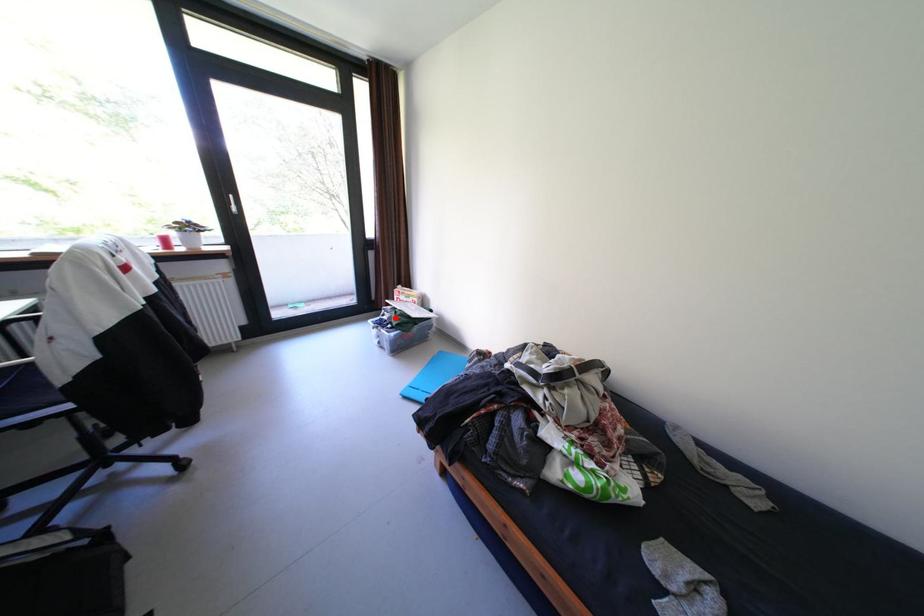
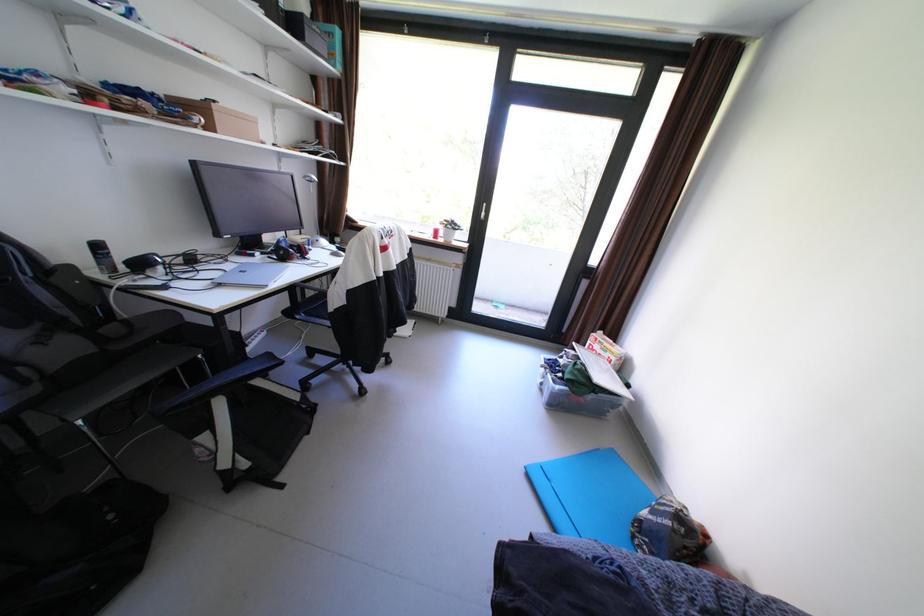
Question: I am providing you with two images of the same scene from different viewpoints. A red point is shown in image1. For the corresponding object point in image2, is it positioned nearer or farther from the camera?

Choices:
 (A) Nearer
 (B) Farther

Answer: (A)